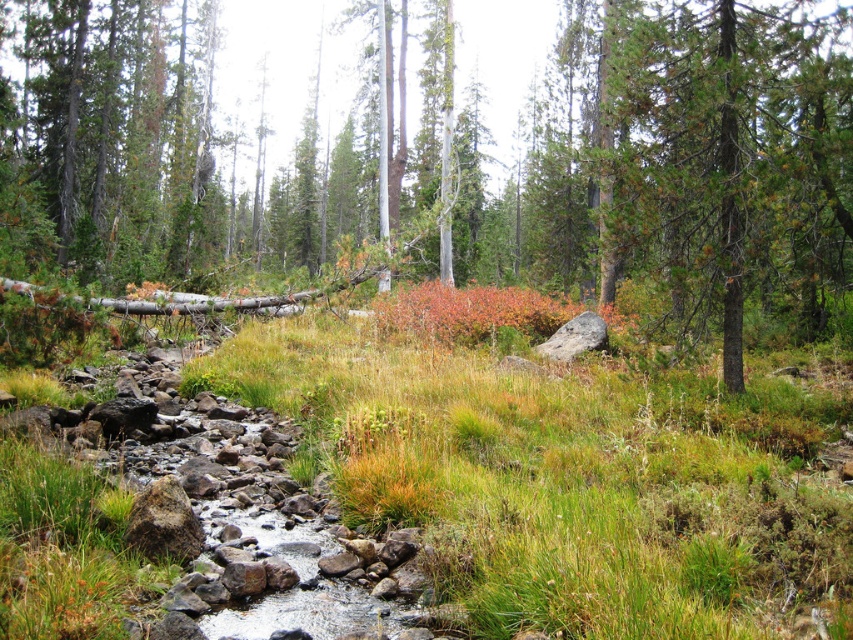
You are standing at the point marked by the coordinates point [645,164] in the forest scene. What object is exactly at that location?

The point [645,164] is exactly at the green matte tree at center.